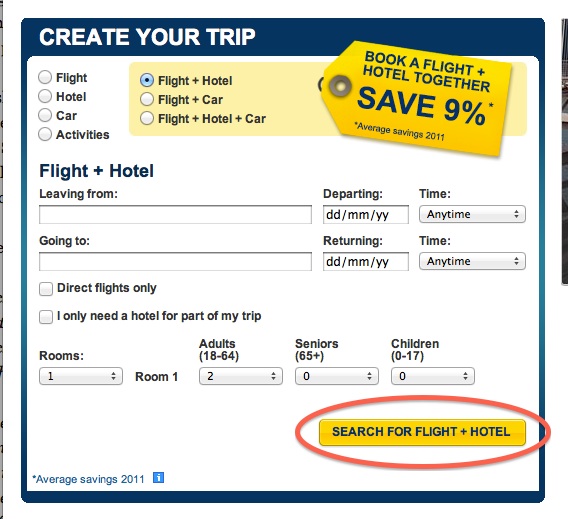
Image resolution: width=568 pixels, height=519 pixels. What are the coordinates of `number of rooms` in the screenshot? It's located at (99, 378).